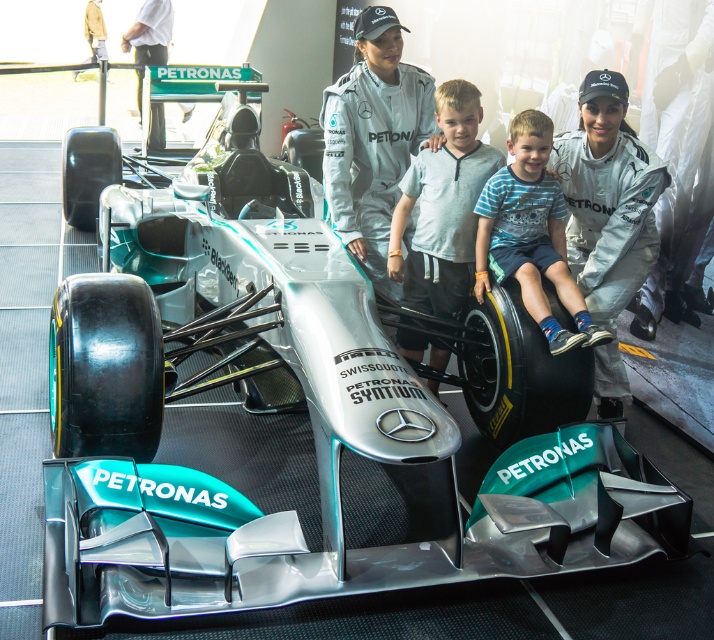
Question: Considering the relative positions of white matte uniform at center and light gray cotton shirt at center in the image provided, where is white matte uniform at center located with respect to light gray cotton shirt at center?

Choices:
 (A) below
 (B) above

Answer: (B)

Question: Estimate the real-world distances between objects in this image. Which object is farther from the white fabric shirt at upper left?

Choices:
 (A) blue striped shirt at center
 (B) white matte uniform at center
 (C) white matte racing suit at center
 (D) light gray cotton shirt at center

Answer: (C)

Question: Is light gray cotton shirt at center positioned behind white fabric shirt at upper left?

Choices:
 (A) no
 (B) yes

Answer: (A)

Question: Which point appears closest to the camera in this image?

Choices:
 (A) (538, 168)
 (B) (441, 120)
 (C) (373, 4)

Answer: (A)

Question: Which object is the farthest from the light gray cotton shirt at center?

Choices:
 (A) white fabric shirt at upper left
 (B) white matte uniform at center
 (C) white matte racing suit at center
 (D) blue striped shirt at center

Answer: (A)

Question: Does white matte uniform at center have a lesser width compared to white fabric shirt at upper left?

Choices:
 (A) yes
 (B) no

Answer: (B)